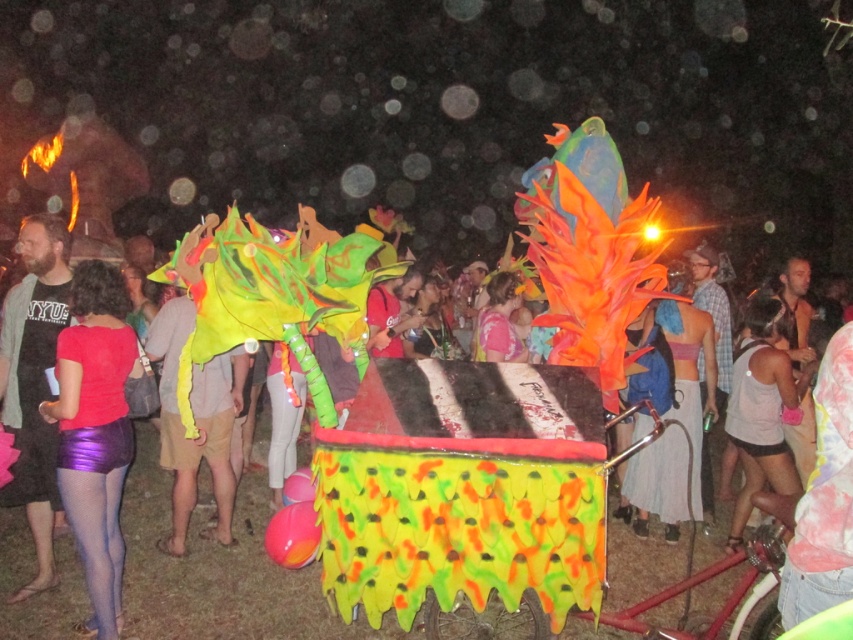
You are at a festival and see a person wearing both the purple shiny shorts at lower left and the white tank top at center. From your perspective, which clothing item appears closer to you?

The purple shiny shorts at lower left appears closer because it is in front of the white tank top at center.

You are standing in the middle of the festival scene. There is a purple shiny shorts at lower left. Can you reach out and touch it without moving your feet?

The purple shiny shorts at lower left is 11.70 feet away from you. Since the average human arm span is about 3 feet, you cannot reach it without moving your feet.

You are standing in front of the decorated cart at the festival. There are two points marked on the cart. The first point is at coordinates point (76, 410) and the second point is at point (19, 464). Which point is closer to your viewpoint?

Point (76, 410) is closer to the camera than point (19, 464).